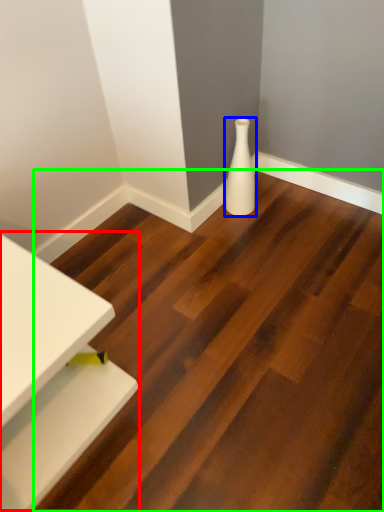
Question: Which is nearer to the table (highlighted by a red box)? vase (highlighted by a blue box) or stair (highlighted by a green box).

Choices:
 (A) vase
 (B) stair

Answer: (B)